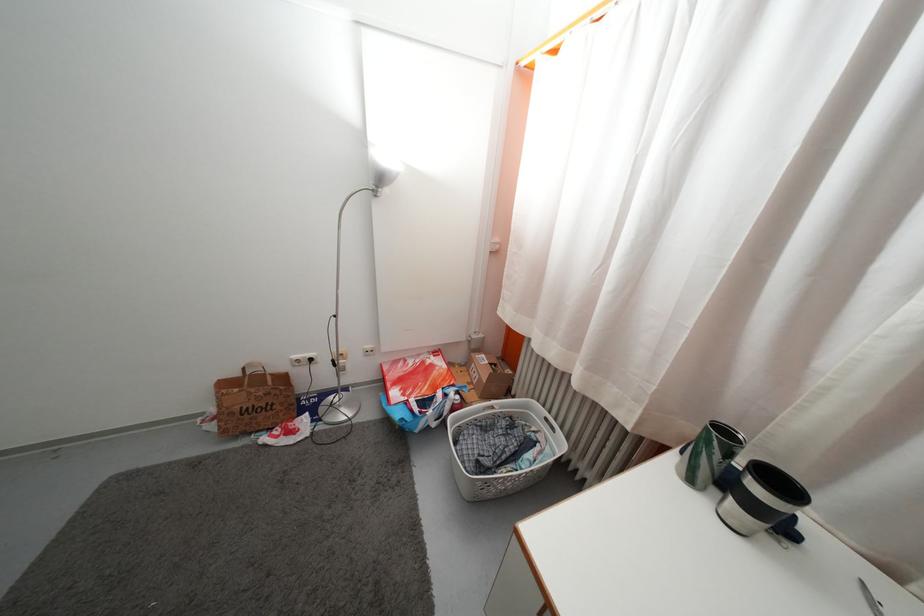
You are a GUI agent. You are given a task and a screenshot of the screen. Output one action in this format:
    pyautogui.click(x=<x>, y=<y>)
    Task: Click on the green travel mug
    
    Given the screenshot: What is the action you would take?
    (709, 454)